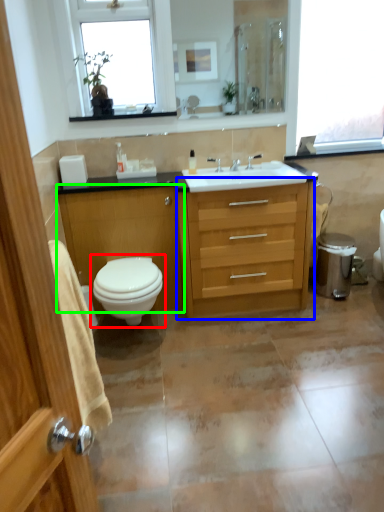
Question: Based on their relative distances, which object is farther from toilet (highlighted by a red box)? Choose from chest of drawers (highlighted by a blue box) and cabinetry (highlighted by a green box).

Choices:
 (A) chest of drawers
 (B) cabinetry

Answer: (A)